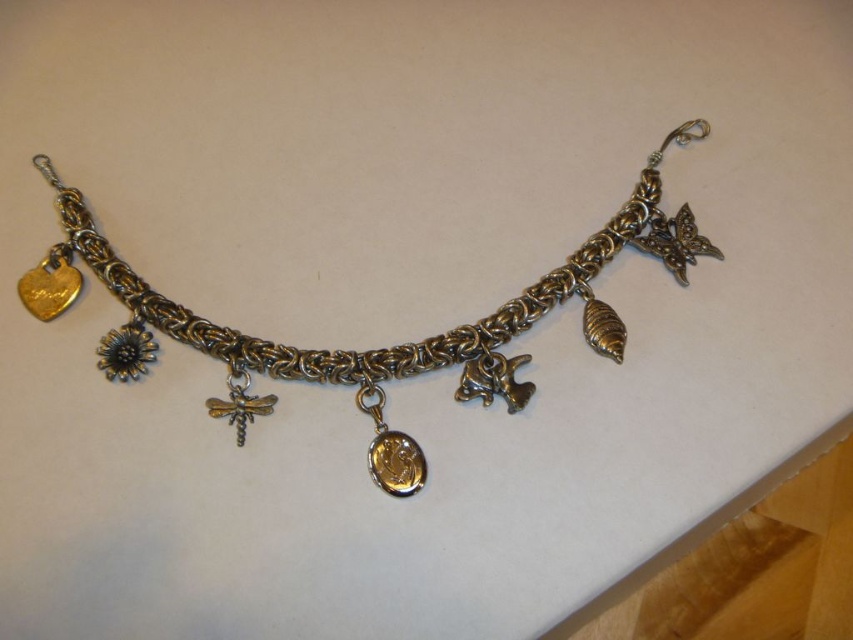
You are a jeweler examining the bracelet. You notice two central elements, the antique gold chain at center and the gold plated medallion at center. Which one is positioned closer to you?

The antique gold chain at center is closer to you since the gold plated medallion at center is positioned behind it.